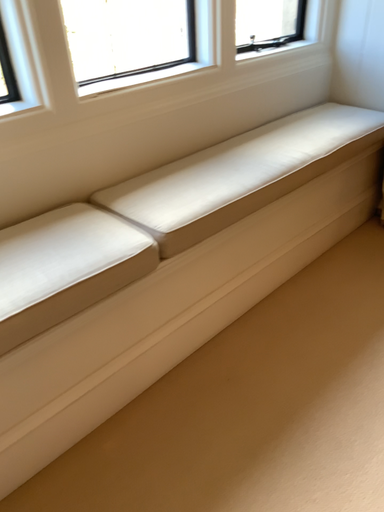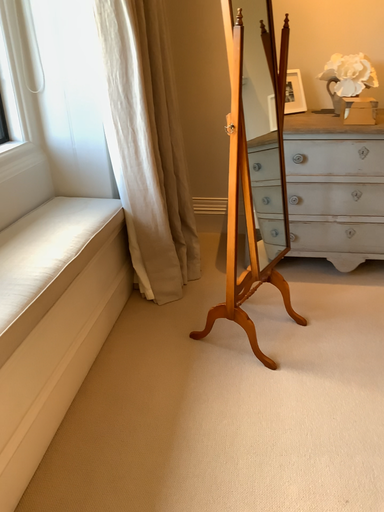
Question: How did the camera likely rotate when shooting the video?

Choices:
 (A) rotated downward
 (B) rotated upward

Answer: (B)